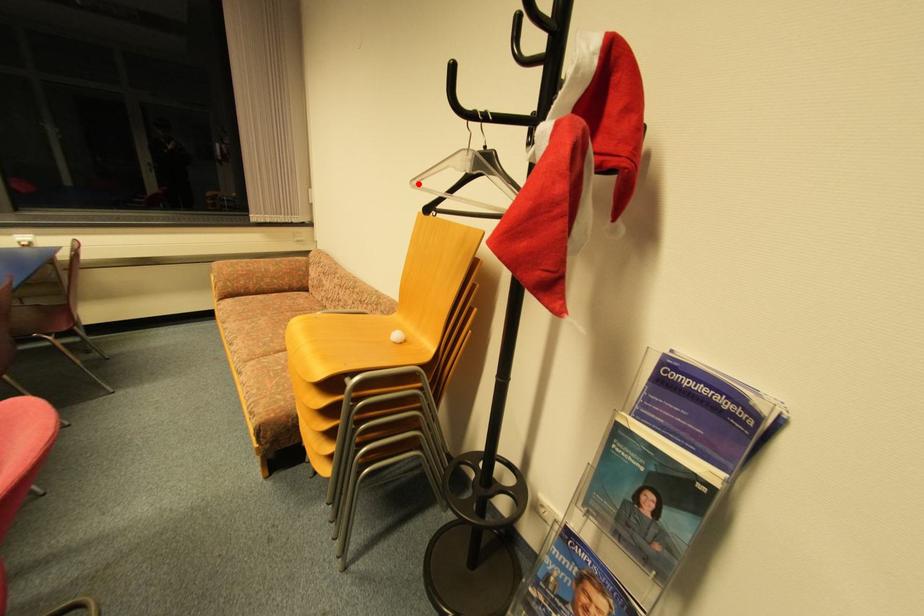
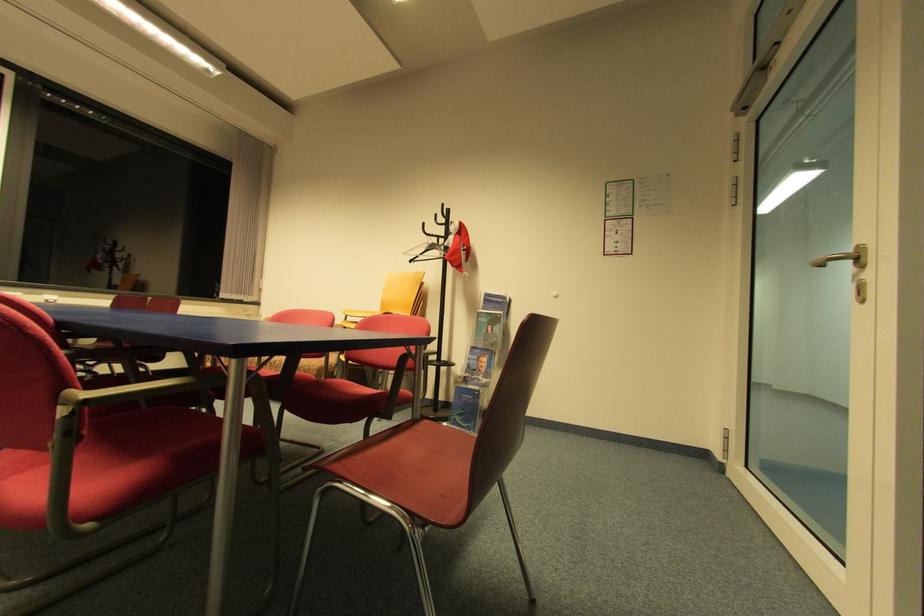
Question: I am providing you with two images of the same scene from different viewpoints. A red point is marked on the first image. At the location where the point appears in image 1, is it still visible in image 2?

Choices:
 (A) Yes
 (B) No

Answer: (A)